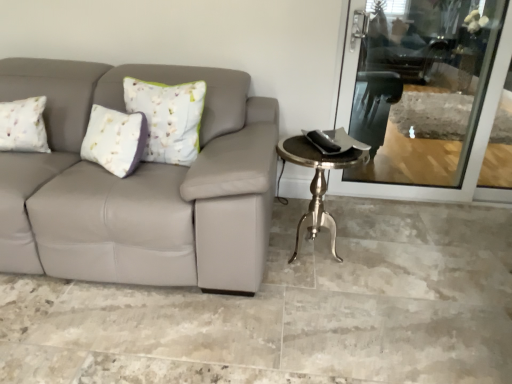
This screenshot has width=512, height=384. Describe the element at coordinates (317, 183) in the screenshot. I see `silver metallic table at right` at that location.

The width and height of the screenshot is (512, 384). I want to click on silver metallic table at right, so click(317, 183).

Is metallic silver swivel chair at upper right aimed at silver metallic table at right?

Yes.

Considering the positions of objects metallic silver swivel chair at upper right and silver metallic table at right in the image provided, who is in front, metallic silver swivel chair at upper right or silver metallic table at right?

silver metallic table at right.

Can we say metallic silver swivel chair at upper right lies outside silver metallic table at right?

That's correct, metallic silver swivel chair at upper right is outside of silver metallic table at right.

Is transparent glass screen door at upper right oriented towards silver metallic table at right?

Yes, transparent glass screen door at upper right is aimed at silver metallic table at right.

Who is shorter, transparent glass screen door at upper right or silver metallic table at right?

silver metallic table at right.

Is transparent glass screen door at upper right wider or thinner than silver metallic table at right?

Considering their sizes, transparent glass screen door at upper right looks slimmer than silver metallic table at right.

Is transparent glass screen door at upper right positioned far away from silver metallic table at right?

transparent glass screen door at upper right is near silver metallic table at right, not far away.

Is transparent glass screen door at upper right positioned behind metallic silver swivel chair at upper right?

No, the depth of transparent glass screen door at upper right is less than that of metallic silver swivel chair at upper right.

From a real-world perspective, who is located lower, transparent glass screen door at upper right or metallic silver swivel chair at upper right?

In real-world perspective, transparent glass screen door at upper right is lower.

Which is in front, point (453, 195) or point (370, 60)?

The point (453, 195) is in front.

From a real-world perspective, who is located higher, silver metallic table at right or metallic silver swivel chair at upper right?

From a 3D spatial view, metallic silver swivel chair at upper right is above.

Is there a large distance between silver metallic table at right and metallic silver swivel chair at upper right?

silver metallic table at right is far away from metallic silver swivel chair at upper right.

In the image, there is a metallic silver swivel chair at upper right. Identify the location of table below it (from the image's perspective). (317, 183).

The image size is (512, 384). What are the coordinates of `table below the transparent glass screen door at upper right (from the image's perspective)` in the screenshot? It's located at (317, 183).

Can you confirm if silver metallic table at right is smaller than transparent glass screen door at upper right?

No.

Is metallic silver swivel chair at upper right positioned far away from transparent glass screen door at upper right?

No, metallic silver swivel chair at upper right is not far away from transparent glass screen door at upper right.

Which is in front, point (368, 44) or point (455, 200)?

The point (455, 200) is closer.

Is metallic silver swivel chair at upper right facing away from transparent glass screen door at upper right?

No, metallic silver swivel chair at upper right is not facing away from transparent glass screen door at upper right.

Which of these two, metallic silver swivel chair at upper right or transparent glass screen door at upper right, is wider?

Wider between the two is metallic silver swivel chair at upper right.

I want to click on swivel chair on the right side of silver metallic table at right, so click(x=401, y=50).

Locate an element on the screen. This screenshot has height=384, width=512. table below the transparent glass screen door at upper right (from a real-world perspective) is located at coordinates (317, 183).

Considering their positions, is metallic silver swivel chair at upper right positioned further to silver metallic table at right than transparent glass screen door at upper right?

metallic silver swivel chair at upper right is further to silver metallic table at right.

When comparing their distances from metallic silver swivel chair at upper right, does silver metallic table at right or transparent glass screen door at upper right seem closer?

transparent glass screen door at upper right is closer to metallic silver swivel chair at upper right.

Based on their spatial positions, is transparent glass screen door at upper right or metallic silver swivel chair at upper right further from silver metallic table at right?

metallic silver swivel chair at upper right is further to silver metallic table at right.

From the image, which object appears to be farther from transparent glass screen door at upper right, silver metallic table at right or metallic silver swivel chair at upper right?

Among the two, silver metallic table at right is located further to transparent glass screen door at upper right.

Looking at the image, which one is located further to metallic silver swivel chair at upper right, transparent glass screen door at upper right or silver metallic table at right?

Among the two, silver metallic table at right is located further to metallic silver swivel chair at upper right.

Which object lies further to the anchor point transparent glass screen door at upper right, metallic silver swivel chair at upper right or silver metallic table at right?

Based on the image, silver metallic table at right appears to be further to transparent glass screen door at upper right.

This screenshot has width=512, height=384. What are the coordinates of `screen door between silver metallic table at right and metallic silver swivel chair at upper right from front to back` in the screenshot? It's located at (470, 152).